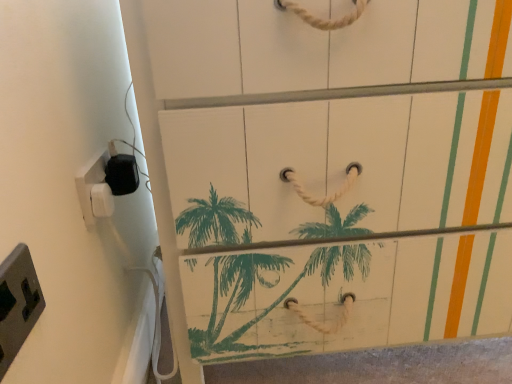
Question: Can you confirm if white plastic/light switch at left, which is counted as the third light switch, starting from the front, is shorter than white plastic/light switch at left, marked as the second light switch in a front-to-back arrangement?

Choices:
 (A) yes
 (B) no

Answer: (A)

Question: From a real-world perspective, is white plastic/light switch at left, which appears as the first light switch when viewed from the back, positioned under white plastic/light switch at left, marked as the second light switch in a front-to-back arrangement, based on gravity?

Choices:
 (A) no
 (B) yes

Answer: (B)

Question: Is white plastic/light switch at left, which appears as the first light switch when viewed from the back, further to camera compared to white plastic/light switch at left, marked as the second light switch in a front-to-back arrangement?

Choices:
 (A) yes
 (B) no

Answer: (A)

Question: Does white plastic/light switch at left, which appears as the first light switch when viewed from the back, have a greater width compared to white plastic/light switch at left, which ranks as the second light switch in back-to-front order?

Choices:
 (A) no
 (B) yes

Answer: (B)

Question: Is white plastic/light switch at left, which appears as the first light switch when viewed from the back, outside of white plastic/light switch at left, which ranks as the second light switch in back-to-front order?

Choices:
 (A) yes
 (B) no

Answer: (A)

Question: Based on their positions, is white plastic/light switch at left, marked as the second light switch in a front-to-back arrangement, located to the left or right of white plastic/light switch at left, which is counted as the third light switch, starting from the front?

Choices:
 (A) right
 (B) left

Answer: (B)

Question: From a real-world perspective, is white plastic/light switch at left, marked as the second light switch in a front-to-back arrangement, positioned above or below white plastic/light switch at left, which is counted as the third light switch, starting from the front?

Choices:
 (A) below
 (B) above

Answer: (B)

Question: Based on their sizes in the image, would you say white plastic/light switch at left, marked as the second light switch in a front-to-back arrangement, is bigger or smaller than white plastic/light switch at left, which is counted as the third light switch, starting from the front?

Choices:
 (A) small
 (B) big

Answer: (B)

Question: Is point (90, 158) positioned closer to the camera than point (111, 190)?

Choices:
 (A) closer
 (B) farther

Answer: (A)

Question: Is gray plastic/light switch at lower left, placed as the 1th light switch when sorted from front to back, to the left or to the right of white plastic/light switch at left, marked as the second light switch in a front-to-back arrangement, in the image?

Choices:
 (A) right
 (B) left

Answer: (A)

Question: Looking at their shapes, would you say gray plastic/light switch at lower left, placed as the 1th light switch when sorted from front to back, is wider or thinner than white plastic/light switch at left, marked as the second light switch in a front-to-back arrangement?

Choices:
 (A) thin
 (B) wide

Answer: (B)

Question: Is gray plastic/light switch at lower left, acting as the third light switch starting from the back, situated inside white plastic/light switch at left, marked as the second light switch in a front-to-back arrangement, or outside?

Choices:
 (A) outside
 (B) inside

Answer: (A)

Question: Relative to white plastic/light switch at left, marked as the second light switch in a front-to-back arrangement, is gray plastic/light switch at lower left, acting as the third light switch starting from the back, in front or behind?

Choices:
 (A) behind
 (B) front

Answer: (B)

Question: Would you say white plastic/light switch at left, which appears as the first light switch when viewed from the back, is to the left or to the right of white plastic/light switch at left, which ranks as the second light switch in back-to-front order, in the picture?

Choices:
 (A) left
 (B) right

Answer: (B)

Question: From a real-world perspective, is white plastic/light switch at left, which appears as the first light switch when viewed from the back, above or below white plastic/light switch at left, which ranks as the second light switch in back-to-front order?

Choices:
 (A) below
 (B) above

Answer: (A)